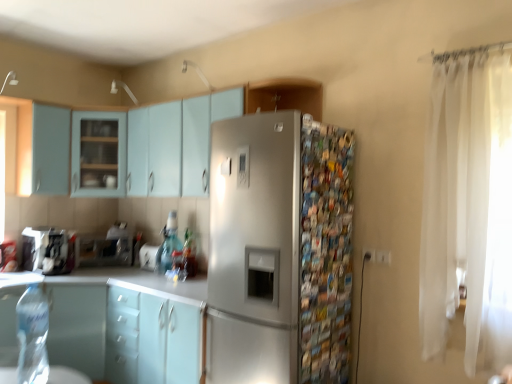
Question: Can you confirm if satin finish cabinet at upper center, the first cabinetry viewed from the top, is thinner than matte white cabinet at lower left, placed as the sixth cabinetry when sorted from top to bottom?

Choices:
 (A) yes
 (B) no

Answer: (A)

Question: Is matte white cabinet at lower left, the second cabinetry when ordered from bottom to top, inside satin finish cabinet at upper center, the seventh cabinetry in the bottom-to-top sequence?

Choices:
 (A) no
 (B) yes

Answer: (A)

Question: Does satin finish cabinet at upper center, the first cabinetry viewed from the top, have a greater height compared to matte white cabinet at lower left, placed as the sixth cabinetry when sorted from top to bottom?

Choices:
 (A) no
 (B) yes

Answer: (A)

Question: Can you confirm if satin finish cabinet at upper center, the first cabinetry viewed from the top, is bigger than matte white cabinet at lower left, placed as the sixth cabinetry when sorted from top to bottom?

Choices:
 (A) no
 (B) yes

Answer: (A)

Question: Is there a large distance between satin finish cabinet at upper center, the first cabinetry viewed from the top, and matte white cabinet at lower left, placed as the sixth cabinetry when sorted from top to bottom?

Choices:
 (A) yes
 (B) no

Answer: (A)

Question: Considering the positions of point (62, 188) and point (151, 258), is point (62, 188) closer or farther from the camera than point (151, 258)?

Choices:
 (A) closer
 (B) farther

Answer: (A)

Question: Considering the positions of light blue matte cabinet at upper left, arranged as the 2th cabinetry when viewed from the top, and clear glass jar at center, the first appliance in the right-to-left sequence, in the image, is light blue matte cabinet at upper left, arranged as the 2th cabinetry when viewed from the top, wider or thinner than clear glass jar at center, the first appliance in the right-to-left sequence,?

Choices:
 (A) wide
 (B) thin

Answer: (A)

Question: Do you think light blue matte cabinet at upper left, which appears as the sixth cabinetry when ordered from the bottom, is within clear glass jar at center, the third appliance in the left-to-right sequence, or outside of it?

Choices:
 (A) inside
 (B) outside

Answer: (B)

Question: From a real-world perspective, is light blue matte cabinet at upper left, which appears as the sixth cabinetry when ordered from the bottom, positioned above or below clear glass jar at center, the first appliance in the right-to-left sequence?

Choices:
 (A) above
 (B) below

Answer: (A)

Question: Considering the positions of clear glass jar at center, the first appliance in the right-to-left sequence, and satin silver refrigerator at center in the image, is clear glass jar at center, the first appliance in the right-to-left sequence, wider or thinner than satin silver refrigerator at center?

Choices:
 (A) thin
 (B) wide

Answer: (A)

Question: Considering the positions of point (147, 258) and point (246, 140), is point (147, 258) closer or farther from the camera than point (246, 140)?

Choices:
 (A) closer
 (B) farther

Answer: (B)

Question: From the image's perspective, is clear glass jar at center, the third appliance in the left-to-right sequence, above or below satin silver refrigerator at center?

Choices:
 (A) above
 (B) below

Answer: (B)

Question: In the image, is clear glass jar at center, the third appliance in the left-to-right sequence, positioned in front of or behind satin silver refrigerator at center?

Choices:
 (A) front
 (B) behind

Answer: (B)

Question: In the image, is light blue matte cabinet at upper left, arranged as the 2th cabinetry when viewed from the top, positioned in front of or behind matte white cabinet at lower left, placed as the sixth cabinetry when sorted from top to bottom?

Choices:
 (A) front
 (B) behind

Answer: (B)

Question: From their relative heights in the image, would you say light blue matte cabinet at upper left, which appears as the sixth cabinetry when ordered from the bottom, is taller or shorter than matte white cabinet at lower left, the second cabinetry when ordered from bottom to top?

Choices:
 (A) short
 (B) tall

Answer: (A)